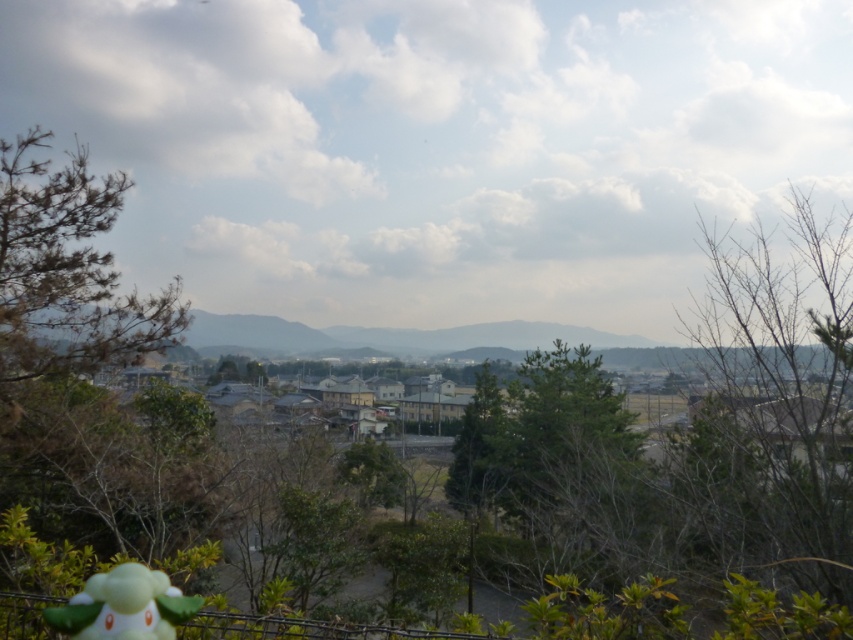
Can you confirm if green leafy tree at center is positioned to the right of white matte plush at lower left?

Yes, green leafy tree at center is to the right of white matte plush at lower left.

Does green leafy tree at center have a greater height compared to white matte plush at lower left?

Yes.

The image size is (853, 640). In order to click on green leafy tree at center in this screenshot , I will do `click(535, 433)`.

Who is more forward, (813, 380) or (194, 612)?

Point (194, 612) is more forward.

Which is behind, point (695, 337) or point (131, 566)?

Point (695, 337)

This screenshot has height=640, width=853. Identify the location of bare branches at upper right. (775, 404).

Is green leafy tree at left closer to the viewer compared to green leafy tree at center?

Yes, green leafy tree at left is closer to the viewer.

Consider the image. Can you confirm if green leafy tree at left is thinner than green leafy tree at center?

Yes, green leafy tree at left is thinner than green leafy tree at center.

Between point (105, 321) and point (477, 500), which one is positioned behind?

Positioned behind is point (477, 500).

The image size is (853, 640). In order to click on green leafy tree at left in this screenshot , I will do `click(67, 273)`.